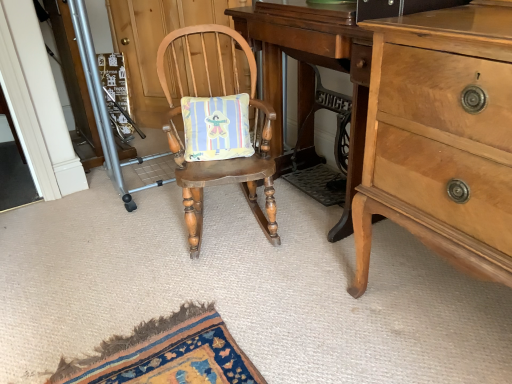
What are the coordinates of `vacant area that lies between light brown wood changing table at center and wooden rocking chair at center` in the screenshot? It's located at click(287, 242).